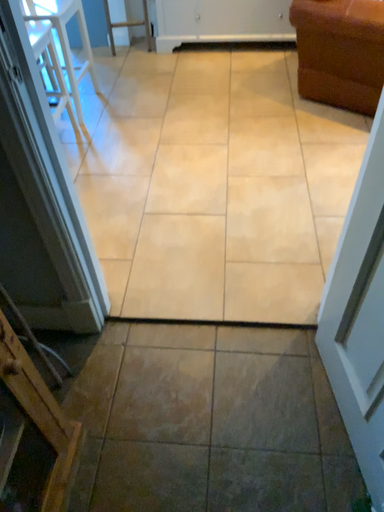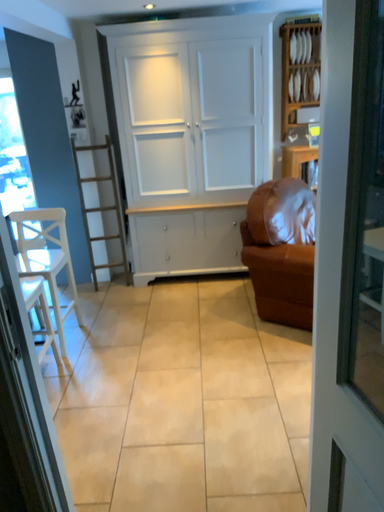
Question: Which way did the camera rotate in the video?

Choices:
 (A) rotated upward
 (B) rotated downward

Answer: (A)